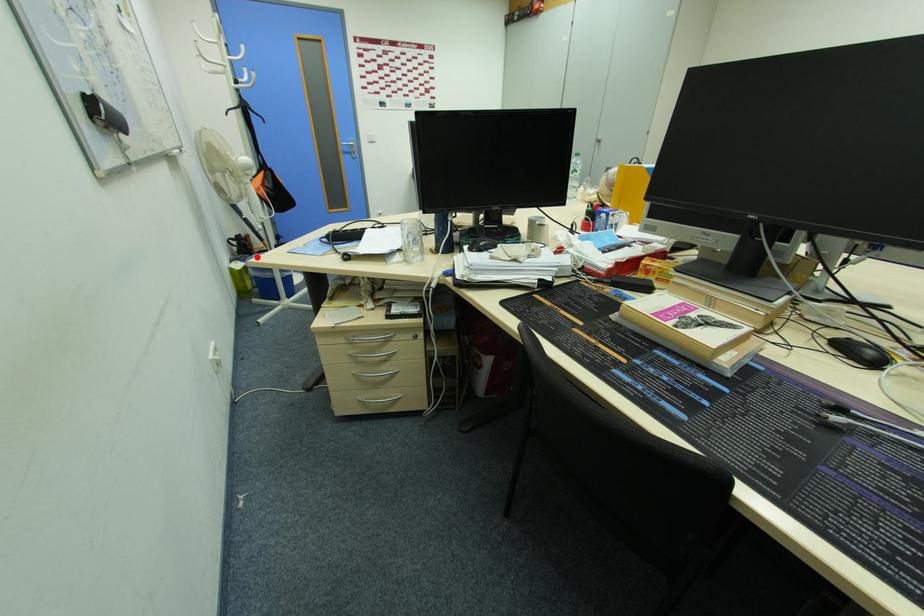
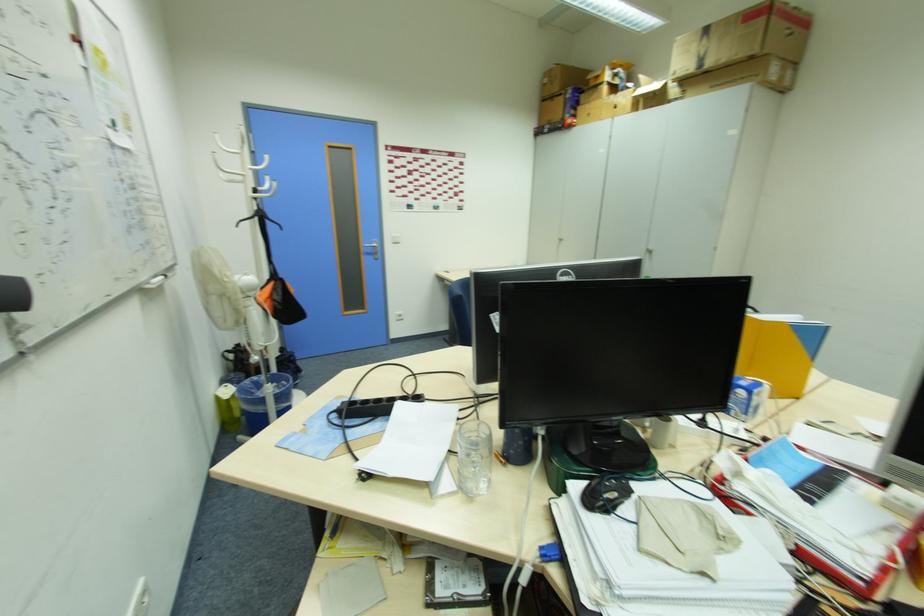
Question: I am providing you with two images of the same scene from different viewpoints. In image1, a red point is highlighted. Considering the same 3D point in image2, which of the following is correct?

Choices:
 (A) It is closer
 (B) It is farther

Answer: (A)